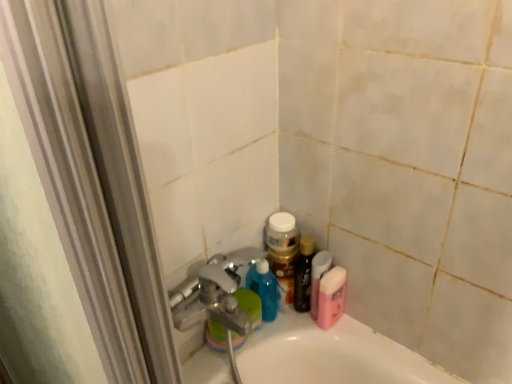
Question: Is pink matte bottle at lower right, which is the second mouthwash from left to right, thinner than pink glossy bottle at upper right, which is the first mouthwash in left-to-right order?

Choices:
 (A) yes
 (B) no

Answer: (B)

Question: Is pink matte bottle at lower right, which ranks as the 1th mouthwash in right-to-left order, at the left side of pink glossy bottle at upper right, marked as the second mouthwash in a right-to-left arrangement?

Choices:
 (A) no
 (B) yes

Answer: (A)

Question: Is pink matte bottle at lower right, which ranks as the 1th mouthwash in right-to-left order, smaller than pink glossy bottle at upper right, which is the first mouthwash in left-to-right order?

Choices:
 (A) yes
 (B) no

Answer: (B)

Question: Does pink matte bottle at lower right, which ranks as the 1th mouthwash in right-to-left order, lie behind pink glossy bottle at upper right, marked as the second mouthwash in a right-to-left arrangement?

Choices:
 (A) yes
 (B) no

Answer: (A)

Question: From the image's perspective, is pink matte bottle at lower right, which is the second mouthwash from left to right, on pink glossy bottle at upper right, marked as the second mouthwash in a right-to-left arrangement?

Choices:
 (A) yes
 (B) no

Answer: (B)

Question: From a real-world perspective, is pink glossy bottle at upper right, which is the first mouthwash in left-to-right order, positioned above or below shiny brown bottle at lower right?

Choices:
 (A) above
 (B) below

Answer: (B)

Question: From the image's perspective, is pink glossy bottle at upper right, which is the first mouthwash in left-to-right order, located above or below shiny brown bottle at lower right?

Choices:
 (A) above
 (B) below

Answer: (B)

Question: Looking at their shapes, would you say pink glossy bottle at upper right, marked as the second mouthwash in a right-to-left arrangement, is wider or thinner than shiny brown bottle at lower right?

Choices:
 (A) thin
 (B) wide

Answer: (B)

Question: Considering the positions of pink glossy bottle at upper right, marked as the second mouthwash in a right-to-left arrangement, and shiny brown bottle at lower right in the image, is pink glossy bottle at upper right, marked as the second mouthwash in a right-to-left arrangement, bigger or smaller than shiny brown bottle at lower right?

Choices:
 (A) big
 (B) small

Answer: (B)

Question: Considering the positions of pink matte bottle at lower right, which ranks as the 1th mouthwash in right-to-left order, and shiny brown bottle at lower right in the image, is pink matte bottle at lower right, which ranks as the 1th mouthwash in right-to-left order, wider or thinner than shiny brown bottle at lower right?

Choices:
 (A) thin
 (B) wide

Answer: (B)

Question: Is pink matte bottle at lower right, which is the second mouthwash from left to right, spatially inside shiny brown bottle at lower right, or outside of it?

Choices:
 (A) inside
 (B) outside

Answer: (B)

Question: Is point (321, 317) closer or farther from the camera than point (308, 309)?

Choices:
 (A) farther
 (B) closer

Answer: (B)

Question: Is pink matte bottle at lower right, which is the second mouthwash from left to right, in front of or behind shiny brown bottle at lower right in the image?

Choices:
 (A) behind
 (B) front

Answer: (B)

Question: Is shiny brown bottle at lower right taller or shorter than pink glossy bottle at upper right, marked as the second mouthwash in a right-to-left arrangement?

Choices:
 (A) tall
 (B) short

Answer: (A)

Question: Is shiny brown bottle at lower right wider or thinner than pink glossy bottle at upper right, marked as the second mouthwash in a right-to-left arrangement?

Choices:
 (A) wide
 (B) thin

Answer: (B)